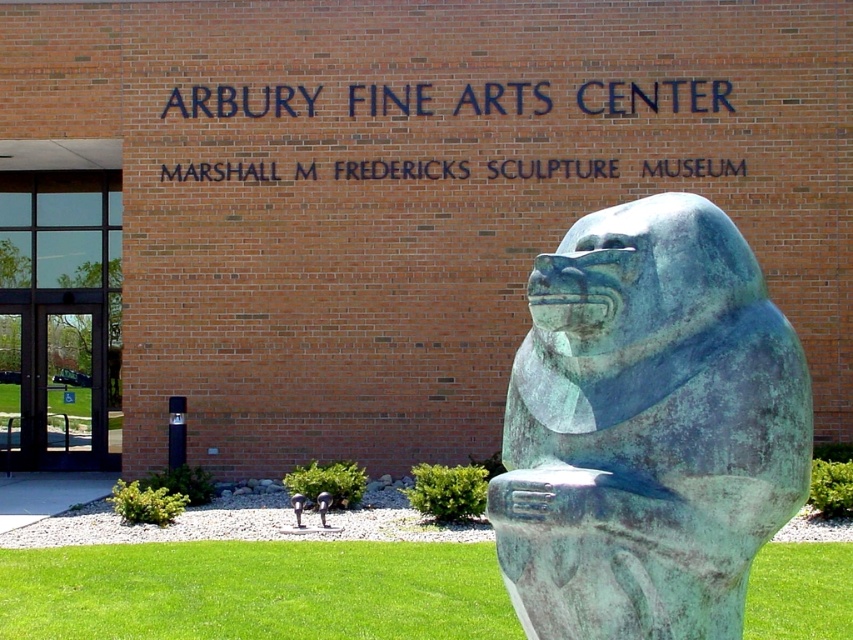
Does green patina stone statue at center have a greater width compared to clear glass door at left?

In fact, green patina stone statue at center might be narrower than clear glass door at left.

Is green patina stone statue at center bigger than clear glass door at left?

Incorrect, green patina stone statue at center is not larger than clear glass door at left.

Is point (672, 440) less distant than point (59, 422)?

Yes, point (672, 440) is in front of point (59, 422).

The width and height of the screenshot is (853, 640). Find the location of `green patina stone statue at center`. green patina stone statue at center is located at coordinates (647, 428).